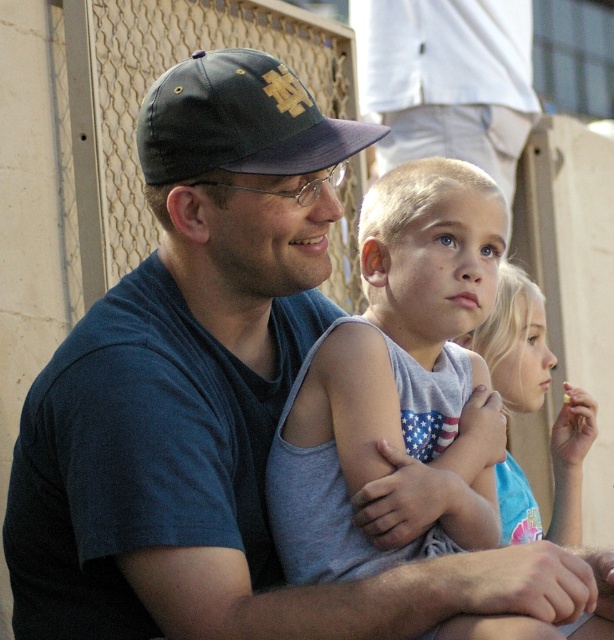
Question: Does dark blue fabric baseball cap at upper left have a greater width compared to light blue tank top at center?

Choices:
 (A) yes
 (B) no

Answer: (A)

Question: Which object appears farthest from the camera in this image?

Choices:
 (A) dark blue fabric baseball cap at upper left
 (B) light blue tank top at center

Answer: (B)

Question: Is dark blue fabric baseball cap at upper left to the left of light blue tank top at center from the viewer's perspective?

Choices:
 (A) no
 (B) yes

Answer: (B)

Question: Which of the following is the closest to the observer?

Choices:
 (A) (497, 358)
 (B) (206, 77)

Answer: (B)

Question: Can you confirm if dark blue fabric baseball cap at upper left is thinner than light blue tank top at center?

Choices:
 (A) no
 (B) yes

Answer: (A)